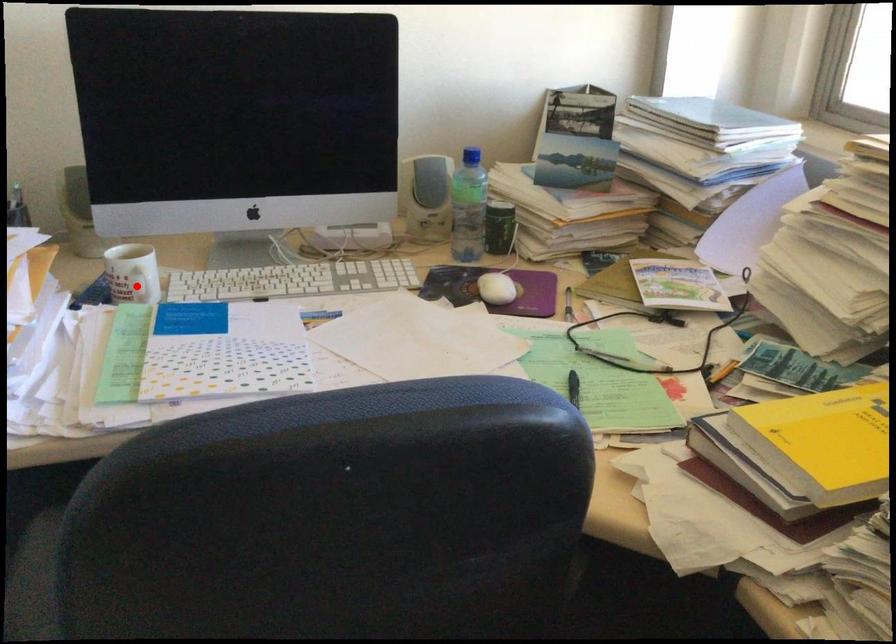
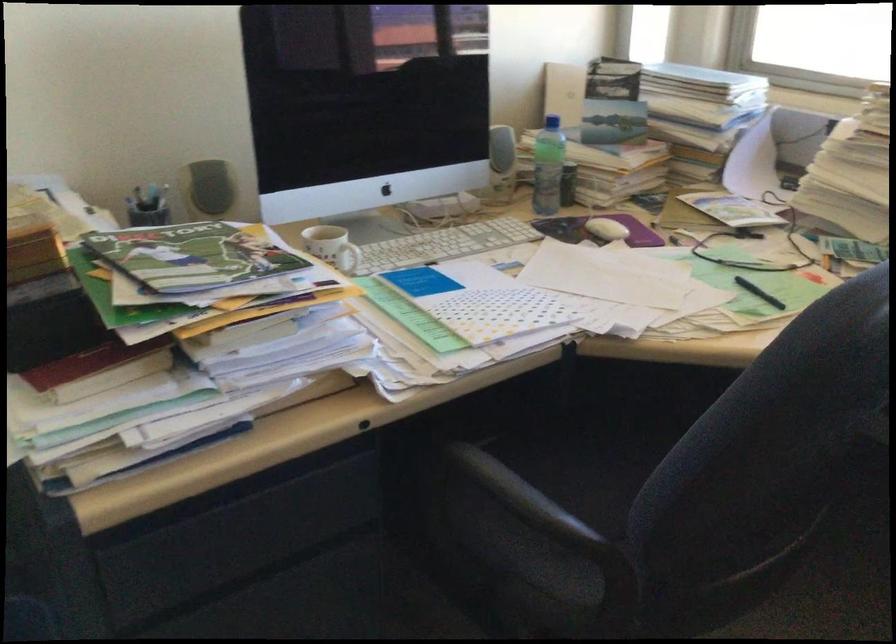
Find the pixel in the second image that matches the highlighted location in the first image.

(348, 258)